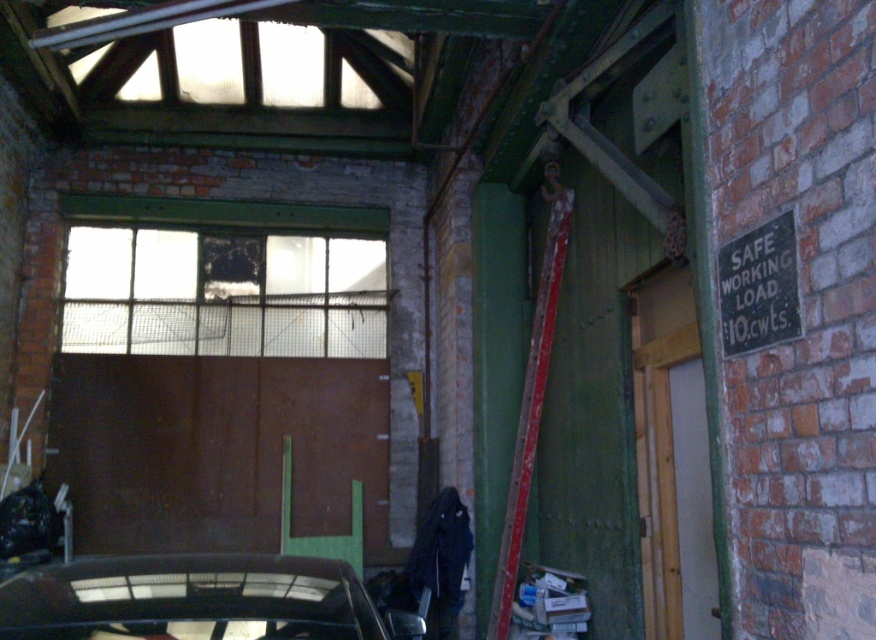
Between rusty metal garage door at center and shiny black car at lower left, which one appears on the right side from the viewer's perspective?

From the viewer's perspective, shiny black car at lower left appears more on the right side.

Is rusty metal garage door at center wider than shiny black car at lower left?

Indeed, rusty metal garage door at center has a greater width compared to shiny black car at lower left.

This screenshot has height=640, width=876. Identify the location of rusty metal garage door at center. (217, 449).

Is rusty metal garage door at center bigger than rusty metal ladder at center?

Yes.

Does rusty metal garage door at center appear on the left side of rusty metal ladder at center?

Yes, rusty metal garage door at center is to the left of rusty metal ladder at center.

The image size is (876, 640). In order to click on rusty metal garage door at center in this screenshot , I will do `click(217, 449)`.

You are a GUI agent. You are given a task and a screenshot of the screen. Output one action in this format:
    pyautogui.click(x=<x>, y=<y>)
    Task: Click on the rusty metal garage door at center
    
    Given the screenshot: What is the action you would take?
    pyautogui.click(x=217, y=449)

Is shiny black car at lower left bigger than rusty metal ladder at center?

Incorrect, shiny black car at lower left is not larger than rusty metal ladder at center.

Looking at this image, which of these two, shiny black car at lower left or rusty metal ladder at center, stands taller?

rusty metal ladder at center

Is point (357, 611) closer to camera compared to point (535, 312)?

Yes, point (357, 611) is closer to viewer.

Locate an element on the screen. This screenshot has width=876, height=640. shiny black car at lower left is located at coordinates (196, 600).